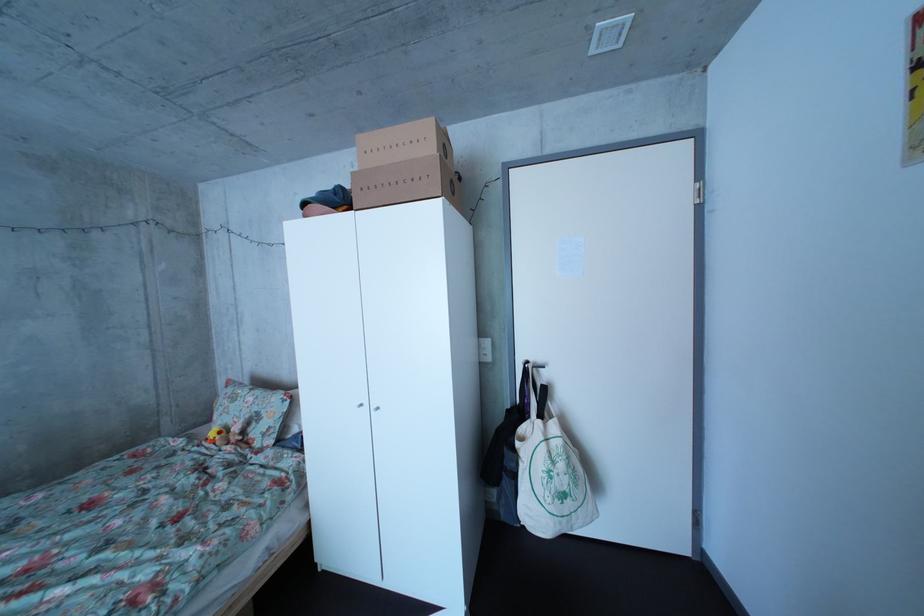
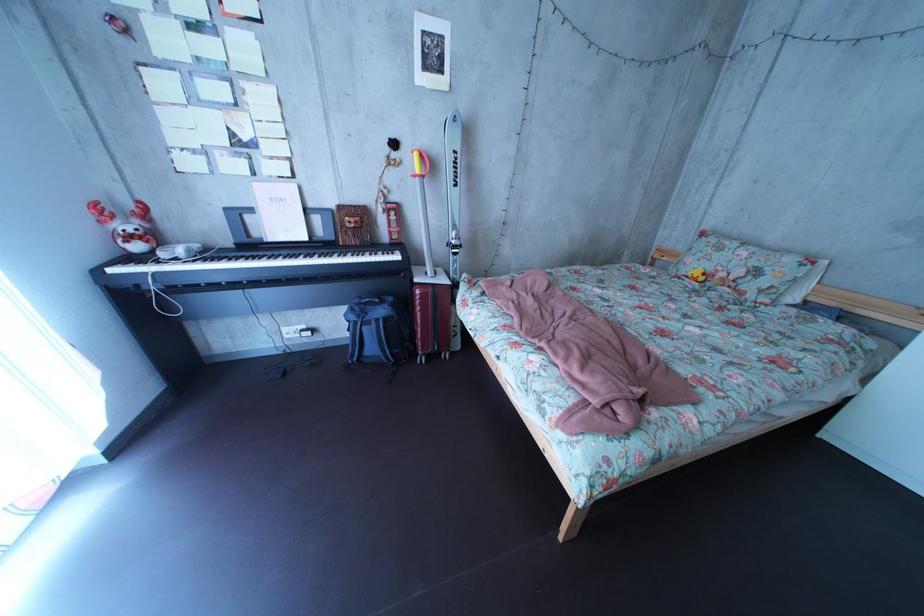
Where in the second image is the point corresponding to the point at 247,415 from the first image?

(731, 262)